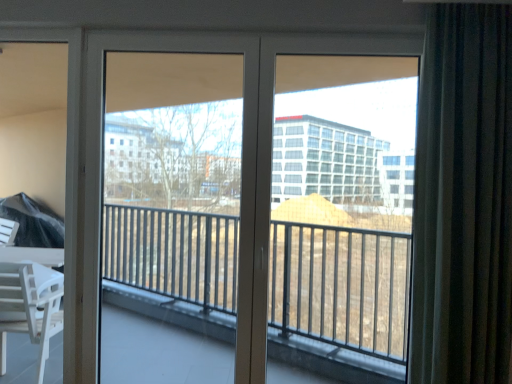
The height and width of the screenshot is (384, 512). Identify the location of empty space that is ontop of clear glass screen door at center (from a real-world perspective). (162, 35).